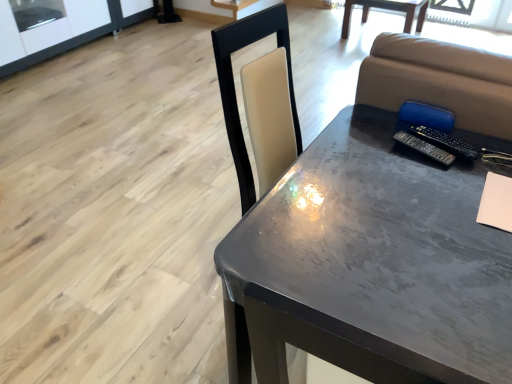
What do you see at coordinates (387, 9) in the screenshot? I see `metallic gray table at center, which is counted as the first table, starting from the back` at bounding box center [387, 9].

Identify the location of black plastic remote at right, which appears as the first remote when viewed from the left. This screenshot has height=384, width=512. 424,148.

Measure the distance between point (x=459, y=152) and camera.

They are 3.88 feet apart.

This screenshot has width=512, height=384. I want to click on transparent glass window screen at upper left, so click(x=36, y=12).

The height and width of the screenshot is (384, 512). I want to click on beige matte notebook at lower right, so click(x=496, y=202).

What do you see at coordinates (426, 115) in the screenshot? The image size is (512, 384). I see `blue fabric armchair at upper right` at bounding box center [426, 115].

This screenshot has height=384, width=512. I want to click on metallic gray table at center, arranged as the first table when viewed from the right, so click(x=387, y=9).

Where is `window screen below the metallic gray table at center, arranged as the first table when viewed from the right (from the image's perspective)`? The width and height of the screenshot is (512, 384). window screen below the metallic gray table at center, arranged as the first table when viewed from the right (from the image's perspective) is located at coordinates (36, 12).

Consider the image. Is the depth of metallic gray table at center, arranged as the first table when viewed from the right, less than that of transparent glass window screen at upper left?

No, it is not.

Visually, is metallic gray table at center, which is counted as the first table, starting from the back, positioned to the left or to the right of transparent glass window screen at upper left?

In the image, metallic gray table at center, which is counted as the first table, starting from the back, appears on the right side of transparent glass window screen at upper left.

How many degrees apart are the facing directions of metallic gray table at center, arranged as the first table when viewed from the right, and transparent glass window screen at upper left?

The angular difference between metallic gray table at center, arranged as the first table when viewed from the right, and transparent glass window screen at upper left is 88.7 degrees.

Considering the positions of point (508, 188) and point (437, 157), is point (508, 188) closer or farther from the camera than point (437, 157)?

Point (508, 188) is positioned closer to the camera compared to point (437, 157).

Which of these two, beige matte notebook at lower right or black plastic remote at right, the 2th remote viewed from the right, is wider?

beige matte notebook at lower right.

Does beige matte notebook at lower right have a smaller size compared to black plastic remote at right, which appears as the first remote when viewed from the left?

Incorrect, beige matte notebook at lower right is not smaller in size than black plastic remote at right, which appears as the first remote when viewed from the left.

Considering the sizes of objects black plastic remote at right, the 2th remote viewed from the right, and transparent glass window screen at upper left in the image provided, who is taller, black plastic remote at right, the 2th remote viewed from the right, or transparent glass window screen at upper left?

With more height is transparent glass window screen at upper left.

Considering the relative sizes of black plastic remote at right, which appears as the first remote when viewed from the left, and transparent glass window screen at upper left in the image provided, is black plastic remote at right, which appears as the first remote when viewed from the left, smaller than transparent glass window screen at upper left?

Yes, black plastic remote at right, which appears as the first remote when viewed from the left, is smaller than transparent glass window screen at upper left.

Is black plastic remote at right, the 2th remote viewed from the right, not within transparent glass window screen at upper left?

black plastic remote at right, the 2th remote viewed from the right, lies outside transparent glass window screen at upper left's area.

Between black plastic remote at right, which appears as the first remote when viewed from the left, and transparent glass window screen at upper left, which one is positioned in front?

black plastic remote at right, which appears as the first remote when viewed from the left, is closer to the camera.

Which of these two, metallic gray table at center, arranged as the first table when viewed from the right, or black plastic remote at right, the 2th remote viewed from the right, is smaller?

black plastic remote at right, the 2th remote viewed from the right.

Considering the sizes of metallic gray table at center, arranged as the first table when viewed from the right, and black plastic remote at right, which appears as the first remote when viewed from the left, in the image, is metallic gray table at center, arranged as the first table when viewed from the right, wider or thinner than black plastic remote at right, which appears as the first remote when viewed from the left,?

Clearly, metallic gray table at center, arranged as the first table when viewed from the right, has more width compared to black plastic remote at right, which appears as the first remote when viewed from the left.

Could black plastic remote at right, the 2th remote viewed from the right, be considered to be inside metallic gray table at center, which appears as the 1th table when viewed from the top?

No, black plastic remote at right, the 2th remote viewed from the right, is located outside of metallic gray table at center, which appears as the 1th table when viewed from the top.

Is metallic gray table at center, positioned as the 2th table in front-to-back order, looking in the opposite direction of black plastic remote at right, which appears as the first remote when viewed from the left?

metallic gray table at center, positioned as the 2th table in front-to-back order, is not turned away from black plastic remote at right, which appears as the first remote when viewed from the left.

Is black plastic remote at upper right, which is counted as the first remote, starting from the right, a part of metallic gray table at center, acting as the 2th table starting from the top?

Yes, black plastic remote at upper right, which is counted as the first remote, starting from the right, can be found within metallic gray table at center, acting as the 2th table starting from the top.

Considering the relative sizes of metallic gray table at center, which ranks as the 2th table in right-to-left order, and black plastic remote at upper right, which is counted as the first remote, starting from the right, in the image provided, is metallic gray table at center, which ranks as the 2th table in right-to-left order, thinner than black plastic remote at upper right, which is counted as the first remote, starting from the right,?

No, metallic gray table at center, which ranks as the 2th table in right-to-left order, is not thinner than black plastic remote at upper right, which is counted as the first remote, starting from the right.

Where is `table below the black plastic remote at upper right, which is counted as the first remote, starting from the right (from the image's perspective)`? This screenshot has height=384, width=512. table below the black plastic remote at upper right, which is counted as the first remote, starting from the right (from the image's perspective) is located at coordinates (370, 265).

Considering the positions of objects metallic gray table at center, which is the first table in bottom-to-top order, and black plastic remote at upper right, which ranks as the second remote in left-to-right order, in the image provided, who is behind, metallic gray table at center, which is the first table in bottom-to-top order, or black plastic remote at upper right, which ranks as the second remote in left-to-right order,?

black plastic remote at upper right, which ranks as the second remote in left-to-right order, is behind.

Considering the sizes of objects blue fabric armchair at upper right and metallic gray table at center, which is counted as the first table, starting from the back, in the image provided, who is wider, blue fabric armchair at upper right or metallic gray table at center, which is counted as the first table, starting from the back,?

With larger width is metallic gray table at center, which is counted as the first table, starting from the back.

Is blue fabric armchair at upper right in contact with metallic gray table at center, positioned as the 2th table in front-to-back order?

blue fabric armchair at upper right and metallic gray table at center, positioned as the 2th table in front-to-back order, are not in contact.

What's the angular difference between blue fabric armchair at upper right and metallic gray table at center, the second table from the left,'s facing directions?

blue fabric armchair at upper right and metallic gray table at center, the second table from the left, are facing 1.09 degrees away from each other.

I want to click on table above the blue fabric armchair at upper right (from the image's perspective), so click(x=387, y=9).

In terms of size, does blue fabric armchair at upper right appear bigger or smaller than black plastic remote at right, which appears as the first remote when viewed from the left?

In the image, blue fabric armchair at upper right appears to be larger than black plastic remote at right, which appears as the first remote when viewed from the left.

Does blue fabric armchair at upper right touch black plastic remote at right, the 2th remote viewed from the right?

blue fabric armchair at upper right and black plastic remote at right, the 2th remote viewed from the right, are clearly separated.

From a real-world perspective, is blue fabric armchair at upper right positioned above or below black plastic remote at right, the 2th remote viewed from the right?

In terms of real-world spatial position, blue fabric armchair at upper right is above black plastic remote at right, the 2th remote viewed from the right.

Considering the sizes of objects blue fabric armchair at upper right and black plastic remote at right, the 2th remote viewed from the right, in the image provided, who is taller, blue fabric armchair at upper right or black plastic remote at right, the 2th remote viewed from the right,?

With more height is blue fabric armchair at upper right.

Image resolution: width=512 pixels, height=384 pixels. I want to click on window screen that is in front of the metallic gray table at center, positioned as the 2th table in front-to-back order, so click(x=36, y=12).

What are the coordinates of `notebook below the black plastic remote at right, the 2th remote viewed from the right (from a real-world perspective)` in the screenshot? It's located at (496, 202).

Estimate the real-world distances between objects in this image. Which object is further from black plastic remote at right, the 2th remote viewed from the right, blue fabric armchair at upper right or black plastic remote at upper right, which is counted as the first remote, starting from the right?

Among the two, blue fabric armchair at upper right is located further to black plastic remote at right, the 2th remote viewed from the right.

Considering their positions, is metallic gray table at center, which is the first table in bottom-to-top order, positioned closer to blue fabric armchair at upper right than metallic gray table at center, which is counted as the first table, starting from the back?

metallic gray table at center, which is the first table in bottom-to-top order, is closer to blue fabric armchair at upper right.

Based on their spatial positions, is transparent glass window screen at upper left or black plastic remote at upper right, which is counted as the first remote, starting from the right, closer to metallic gray table at center, which ranks as the 2th table in right-to-left order?

black plastic remote at upper right, which is counted as the first remote, starting from the right.

Based on their spatial positions, is black plastic remote at upper right, which ranks as the second remote in left-to-right order, or transparent glass window screen at upper left further from black plastic remote at right, which appears as the first remote when viewed from the left?

The object further to black plastic remote at right, which appears as the first remote when viewed from the left, is transparent glass window screen at upper left.

Based on the photo, from the image, which object appears to be nearer to metallic gray table at center, the 2th table positioned from the back, blue fabric armchair at upper right or transparent glass window screen at upper left?

blue fabric armchair at upper right is positioned closer to the anchor metallic gray table at center, the 2th table positioned from the back.

Estimate the real-world distances between objects in this image. Which object is closer to black plastic remote at right, which appears as the first remote when viewed from the left, black plastic remote at upper right, which is counted as the first remote, starting from the right, or metallic gray table at center, positioned as the 1th table in front-to-back order?

black plastic remote at upper right, which is counted as the first remote, starting from the right, is positioned closer to the anchor black plastic remote at right, which appears as the first remote when viewed from the left.

Looking at the image, which one is located further to blue fabric armchair at upper right, metallic gray table at center, acting as the 2th table starting from the top, or black plastic remote at upper right, which ranks as the second remote in left-to-right order?

metallic gray table at center, acting as the 2th table starting from the top, lies further to blue fabric armchair at upper right than the other object.

Based on their spatial positions, is metallic gray table at center, which appears as the 1th table when viewed from the top, or beige matte notebook at lower right further from metallic gray table at center, which is the 1th table in left-to-right order?

The object further to metallic gray table at center, which is the 1th table in left-to-right order, is metallic gray table at center, which appears as the 1th table when viewed from the top.

Locate an element on the screen. Image resolution: width=512 pixels, height=384 pixels. notebook between metallic gray table at center, which ranks as the 2th table in right-to-left order, and transparent glass window screen at upper left, along the z-axis is located at coordinates pyautogui.click(x=496, y=202).

At what (x,y) coordinates should I click in order to perform the action: click on armchair positioned between metallic gray table at center, which is the 1th table in left-to-right order, and transparent glass window screen at upper left from near to far. Please return your answer as a coordinate pair (x, y). The image size is (512, 384). Looking at the image, I should click on (426, 115).

The width and height of the screenshot is (512, 384). I want to click on notebook between metallic gray table at center, which is the first table in bottom-to-top order, and blue fabric armchair at upper right from front to back, so click(x=496, y=202).

Locate an element on the screen. This screenshot has height=384, width=512. remote positioned between beige matte notebook at lower right and black plastic remote at right, which appears as the first remote when viewed from the left, from near to far is located at coordinates (446, 140).